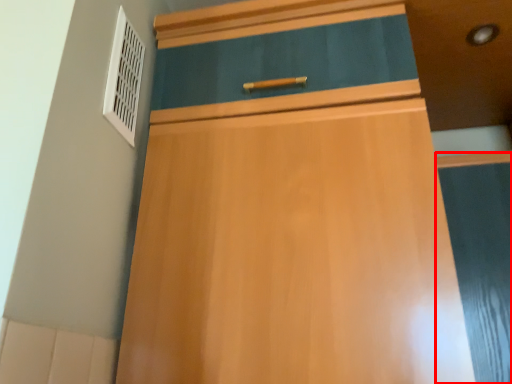
Question: Observing the image, what is the correct spatial positioning of screen door (annotated by the red box) in reference to air conditioning?

Choices:
 (A) left
 (B) right

Answer: (B)